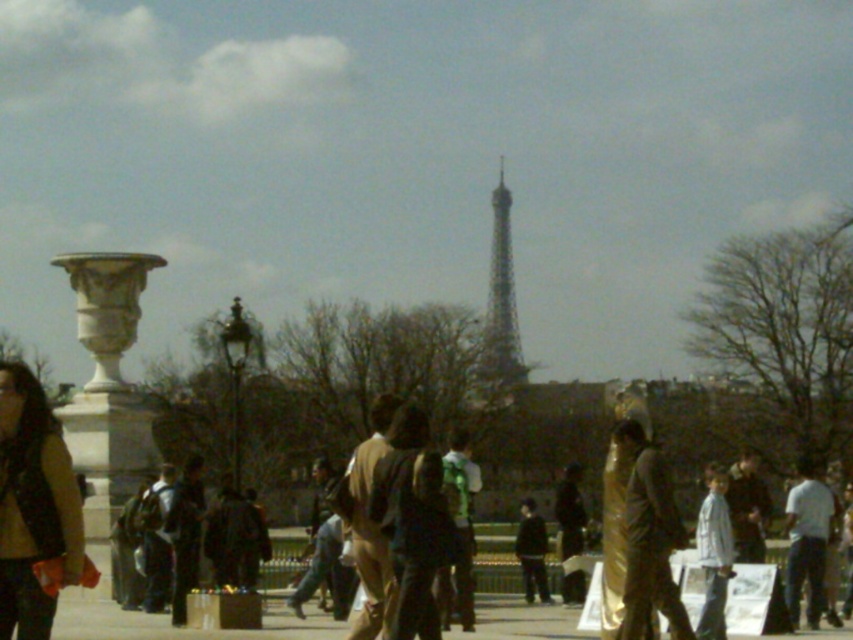
Question: Which of these objects is positioned closest to the metallic silver tower at center?

Choices:
 (A) gold metallic statue at center
 (B) dark brown leather jacket at center
 (C) brown leather jacket at left

Answer: (B)

Question: Is the position of brown leather jacket at left less distant than that of dark brown leather jacket at center?

Choices:
 (A) yes
 (B) no

Answer: (A)

Question: Is brown leather jacket at left bigger than dark brown leather jacket at center?

Choices:
 (A) yes
 (B) no

Answer: (A)

Question: Which point appears farthest from the camera in this image?

Choices:
 (A) (523, 544)
 (B) (634, 486)

Answer: (A)

Question: Considering the real-world distances, which object is farthest from the brown leather jacket at left?

Choices:
 (A) gold metallic statue at center
 (B) metallic silver tower at center
 (C) dark brown leather jacket at center

Answer: (B)

Question: Does brown leather jacket at left appear under gold metallic statue at center?

Choices:
 (A) yes
 (B) no

Answer: (B)